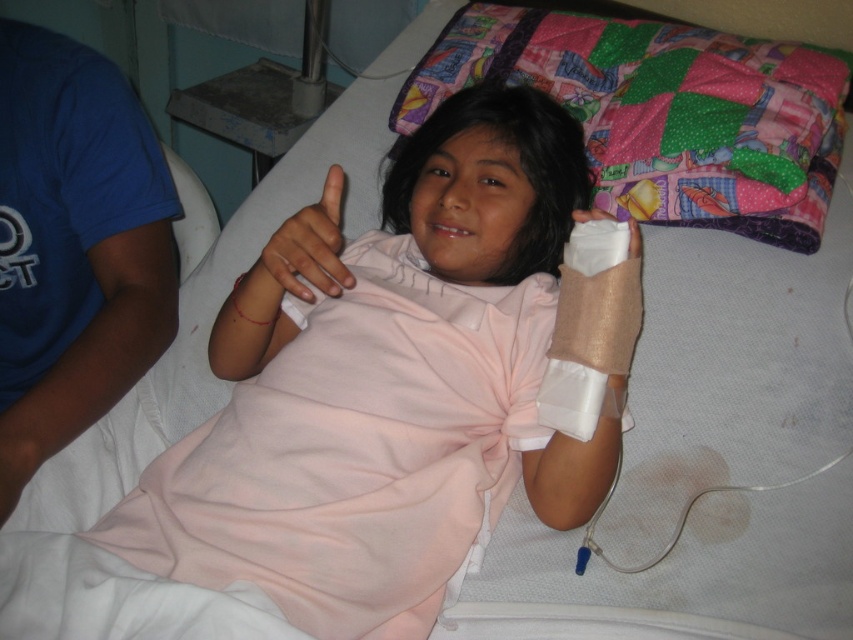
Identify the location of white bandage at center. (303, 252).

Which is above, white bandage at center or beige textured bandage at lower right?

white bandage at center is above.

Measure the distance between point (325, 179) and camera.

The distance of point (325, 179) from camera is 38.13 inches.

At what (x,y) coordinates should I click in order to perform the action: click on white bandage at center. Please return your answer as a coordinate pair (x, y). The width and height of the screenshot is (853, 640). Looking at the image, I should click on (303, 252).

Measure the distance from pink fabric at center to white bandage at center.

The distance of pink fabric at center from white bandage at center is 7.07 inches.

Is pink fabric at center closer to camera compared to white bandage at center?

Yes, it is.

Who is more forward, (596, 493) or (286, 232)?

Point (286, 232) is in front.

In order to click on pink fabric at center in this screenshot , I will do `click(399, 388)`.

Can you confirm if patchwork quilt at upper center is positioned below beige textured bandage at lower right?

Incorrect, patchwork quilt at upper center is not positioned below beige textured bandage at lower right.

Can you confirm if patchwork quilt at upper center is thinner than beige textured bandage at lower right?

Incorrect, patchwork quilt at upper center's width is not less than beige textured bandage at lower right's.

I want to click on patchwork quilt at upper center, so click(663, 113).